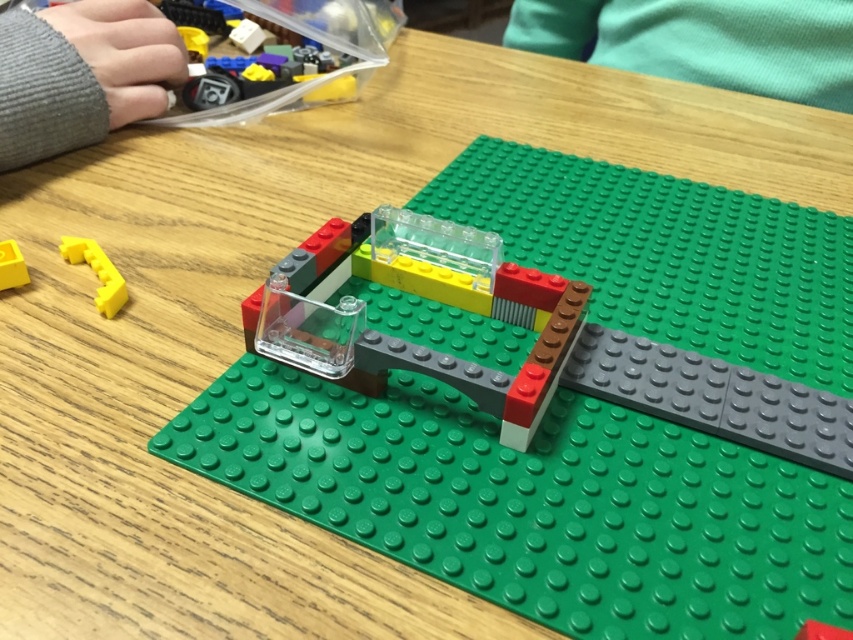
Question: Among these objects, which one is farthest from the camera?

Choices:
 (A) matte yellow plastic piece at lower left
 (B) yellow matte plastic piece at lower left

Answer: (B)

Question: Does matte yellow plastic piece at lower left have a larger size compared to yellow matte plastic piece at lower left?

Choices:
 (A) no
 (B) yes

Answer: (B)

Question: Which point is farther from the camera taking this photo?

Choices:
 (A) (78, 243)
 (B) (9, 269)

Answer: (A)

Question: Is matte yellow plastic piece at lower left wider than yellow matte plastic piece at lower left?

Choices:
 (A) no
 (B) yes

Answer: (B)

Question: Is matte yellow plastic piece at lower left smaller than yellow matte plastic piece at lower left?

Choices:
 (A) no
 (B) yes

Answer: (A)